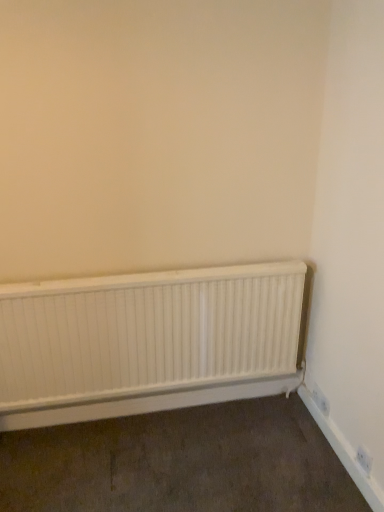
Question: Does white matte radiator at lower center have a smaller size compared to white plastic electric outlet at lower right?

Choices:
 (A) no
 (B) yes

Answer: (A)

Question: From a real-world perspective, is white matte radiator at lower center over white plastic electric outlet at lower right?

Choices:
 (A) no
 (B) yes

Answer: (B)

Question: From the image's perspective, is white matte radiator at lower center below white plastic electric outlet at lower right?

Choices:
 (A) no
 (B) yes

Answer: (A)

Question: Considering the relative positions of white matte radiator at lower center and white plastic electric outlet at lower right in the image provided, is white matte radiator at lower center to the right of white plastic electric outlet at lower right from the viewer's perspective?

Choices:
 (A) yes
 (B) no

Answer: (B)

Question: From the image's perspective, is white matte radiator at lower center above white plastic electric outlet at lower right?

Choices:
 (A) yes
 (B) no

Answer: (A)

Question: Is there a large distance between white matte radiator at lower center and white plastic electric outlet at lower right?

Choices:
 (A) yes
 (B) no

Answer: (B)

Question: Does white plastic electric outlet at lower right have a greater width compared to white matte radiator at lower center?

Choices:
 (A) yes
 (B) no

Answer: (B)

Question: Is white plastic electric outlet at lower right positioned in front of white matte radiator at lower center?

Choices:
 (A) no
 (B) yes

Answer: (A)

Question: Are white plastic electric outlet at lower right and white matte radiator at lower center making contact?

Choices:
 (A) yes
 (B) no

Answer: (B)

Question: Is white plastic electric outlet at lower right turned away from white matte radiator at lower center?

Choices:
 (A) no
 (B) yes

Answer: (A)

Question: Considering the relative positions of white plastic electric outlet at lower right and white matte radiator at lower center in the image provided, is white plastic electric outlet at lower right to the right of white matte radiator at lower center from the viewer's perspective?

Choices:
 (A) no
 (B) yes

Answer: (B)

Question: From the image's perspective, does white plastic electric outlet at lower right appear higher than white matte radiator at lower center?

Choices:
 (A) yes
 (B) no

Answer: (B)

Question: Considering the positions of white plastic electric outlet at lower right and white matte radiator at lower center in the image, is white plastic electric outlet at lower right taller or shorter than white matte radiator at lower center?

Choices:
 (A) short
 (B) tall

Answer: (A)